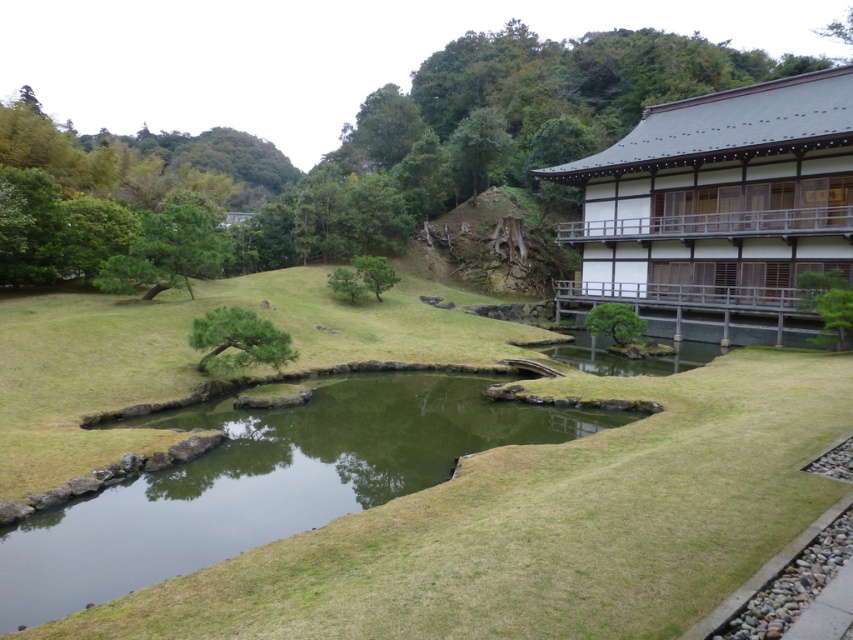
Between point (250, 198) and point (344, 400), which one is positioned behind?

Positioned behind is point (250, 198).

Consider the image. Does green leafy tree at center appear under green grassy water at center?

Actually, green leafy tree at center is above green grassy water at center.

Identify the location of green leafy tree at center. (422, 132).

Is green leafy tree at center above green matte bonsai tree at center?

Correct, green leafy tree at center is located above green matte bonsai tree at center.

Does green leafy tree at center have a larger size compared to green matte bonsai tree at center?

Indeed, green leafy tree at center has a larger size compared to green matte bonsai tree at center.

Is point (677, 72) positioned after point (601, 332)?

Yes, it is behind point (601, 332).

Identify the location of green leafy tree at center. (422, 132).

Who is higher up, green grassy water at center or green leafy tree at right?

green leafy tree at right is above.

Who is shorter, green grassy water at center or green leafy tree at right?

With less height is green leafy tree at right.

Who is more distant from viewer, (53,586) or (811,339)?

Positioned behind is point (811,339).

Identify the location of green grassy water at center. (265, 483).